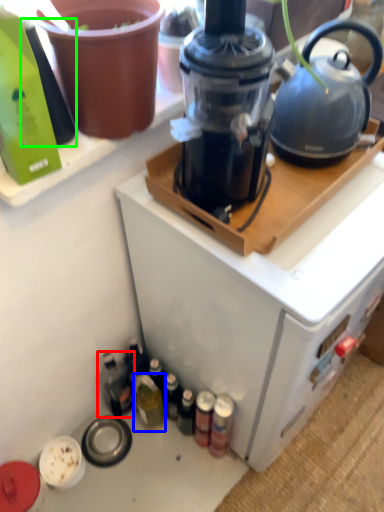
Question: Which is farther away from bottle (highlighted by a red box)? bottle (highlighted by a blue box) or bottle (highlighted by a green box)?

Choices:
 (A) bottle
 (B) bottle

Answer: (B)